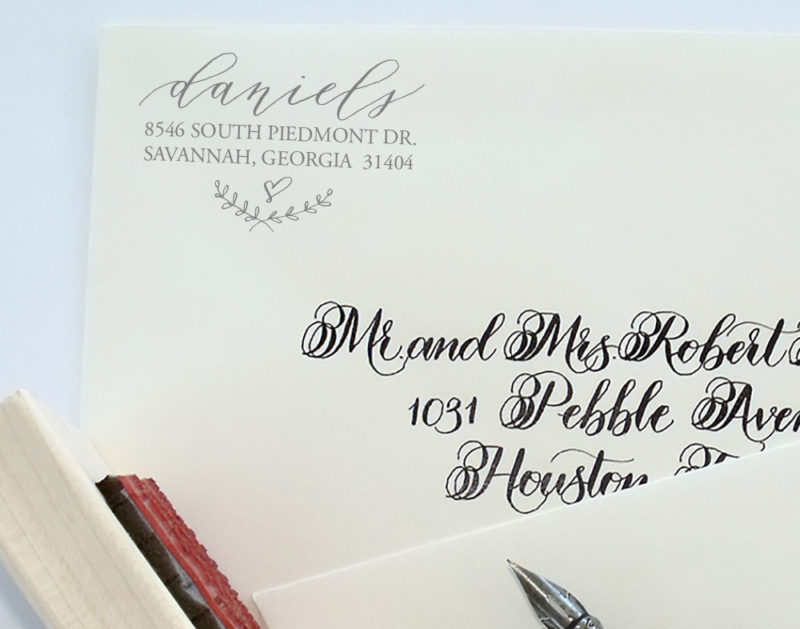
You are a GUI agent. You are given a task and a screenshot of the screen. Output one action in this format:
    pyautogui.click(x=<x>, y=<y>)
    Task: Click on the table
    
    Given the screenshot: What is the action you would take?
    pyautogui.click(x=64, y=260)